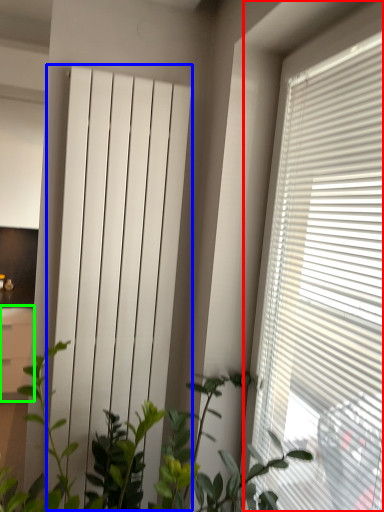
Question: Considering the real-world distances, which object is farthest from window blind (highlighted by a red box)? curtain (highlighted by a blue box) or file cabinet (highlighted by a green box)?

Choices:
 (A) curtain
 (B) file cabinet

Answer: (B)